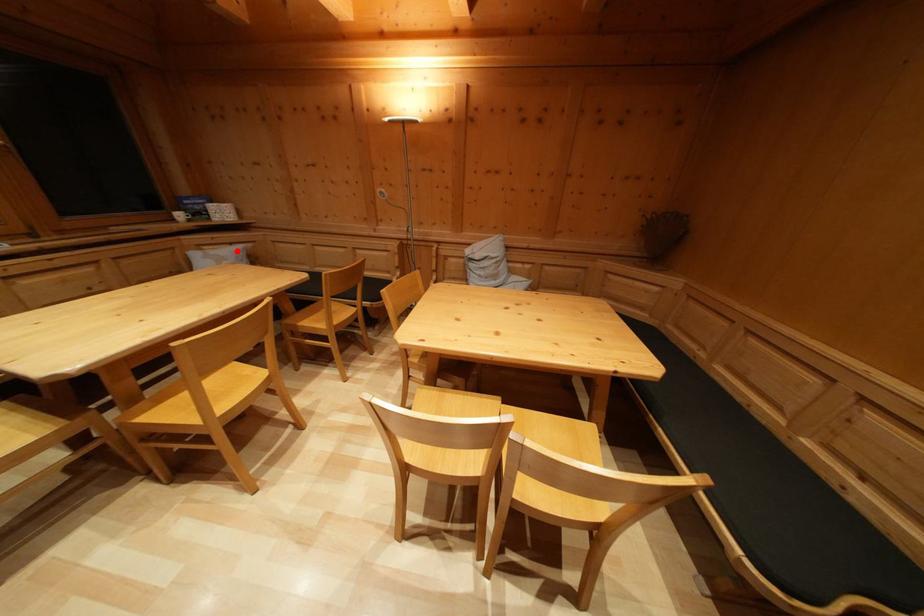
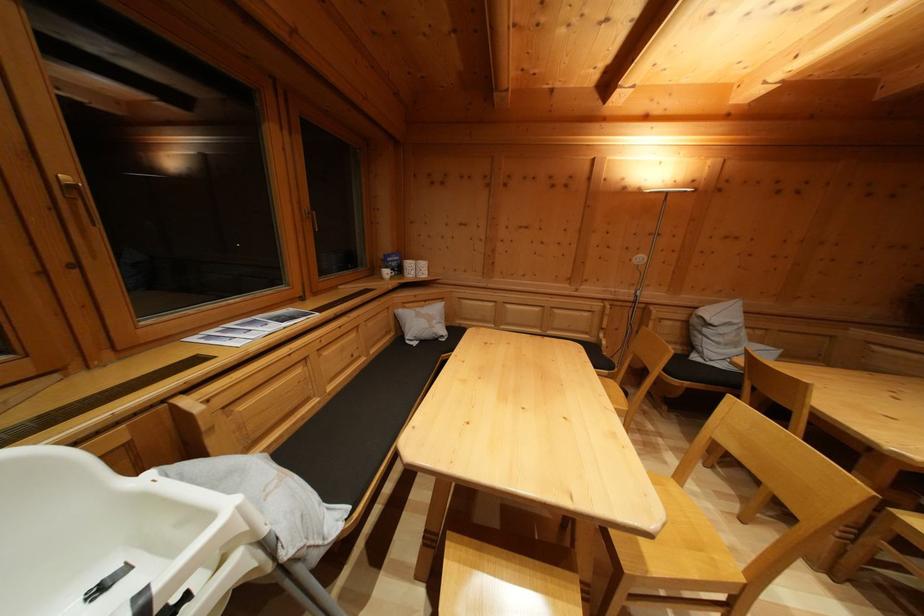
Question: I am providing you with two images of the same scene from different viewpoints. Given a red point in image1, look at the same physical point in image2. Is it:

Choices:
 (A) Closer to the viewpoint
 (B) Farther from the viewpoint

Answer: (B)